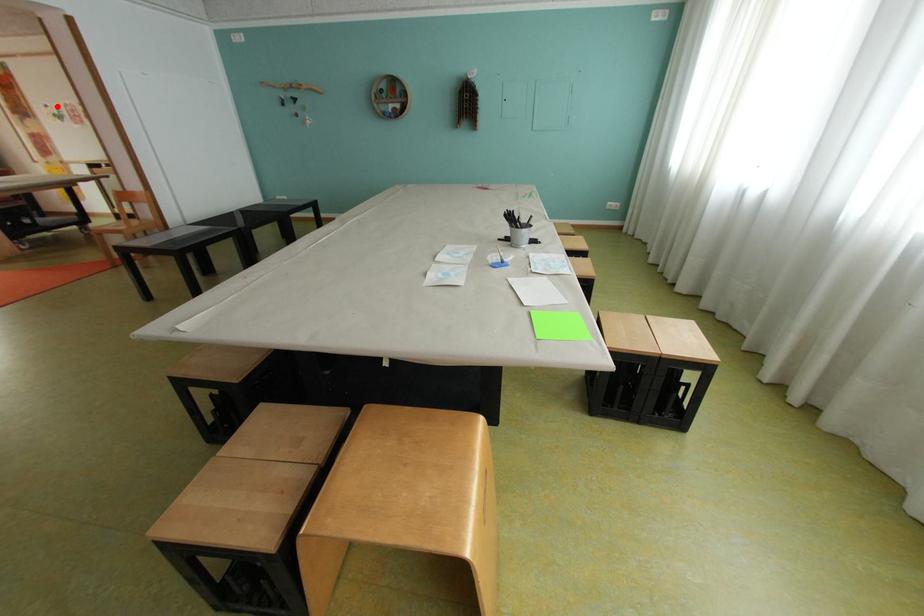
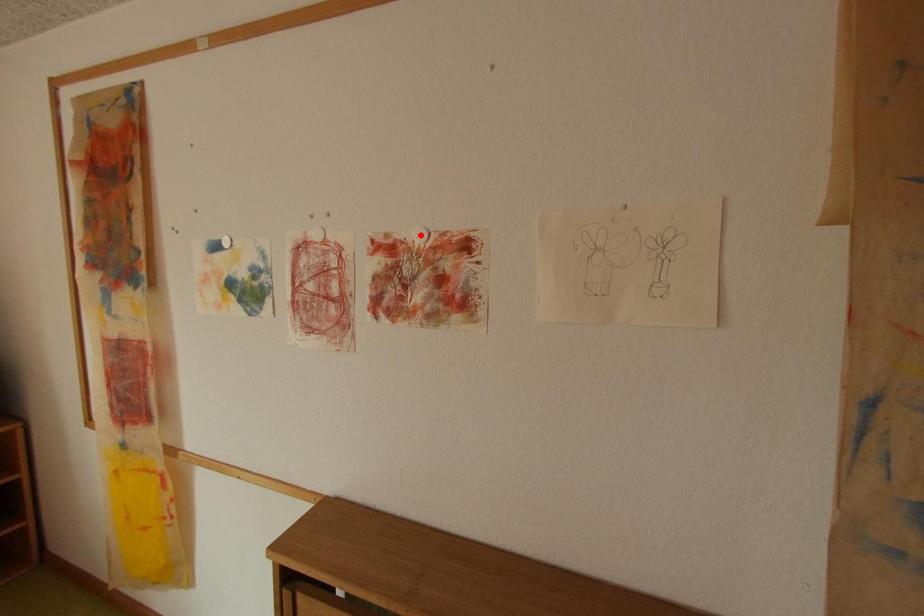
I am providing you with two images of the same scene from different viewpoints. A red point is marked on the first image and another point is marked on the second image. Is the red point in image1 aligned with the point shown in image2?

No